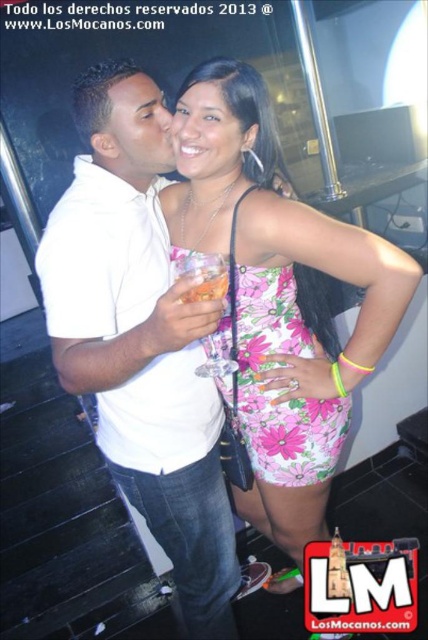
Who is positioned more to the right, white matte shirt at center or translucent glass drink at center?

translucent glass drink at center

The image size is (428, 640). What do you see at coordinates (140, 339) in the screenshot? I see `white matte shirt at center` at bounding box center [140, 339].

The height and width of the screenshot is (640, 428). In order to click on white matte shirt at center in this screenshot , I will do `click(140, 339)`.

The height and width of the screenshot is (640, 428). What do you see at coordinates (279, 300) in the screenshot?
I see `pink floral dress at center` at bounding box center [279, 300].

The height and width of the screenshot is (640, 428). Find the location of `pink floral dress at center`. pink floral dress at center is located at coordinates (279, 300).

Is point (333, 461) closer to viewer compared to point (189, 291)?

No, it is behind (189, 291).

Identify the location of pink floral dress at center. (279, 300).

Between white matte shirt at center and pink floral dress at center, which one appears on the right side from the viewer's perspective?

From the viewer's perspective, pink floral dress at center appears more on the right side.

Is point (125, 250) positioned after point (189, 74)?

That is False.

Who is more distant from viewer, (65, 220) or (303, 513)?

The point (303, 513) is behind.

Where is `white matte shirt at center`? This screenshot has width=428, height=640. white matte shirt at center is located at coordinates (140, 339).